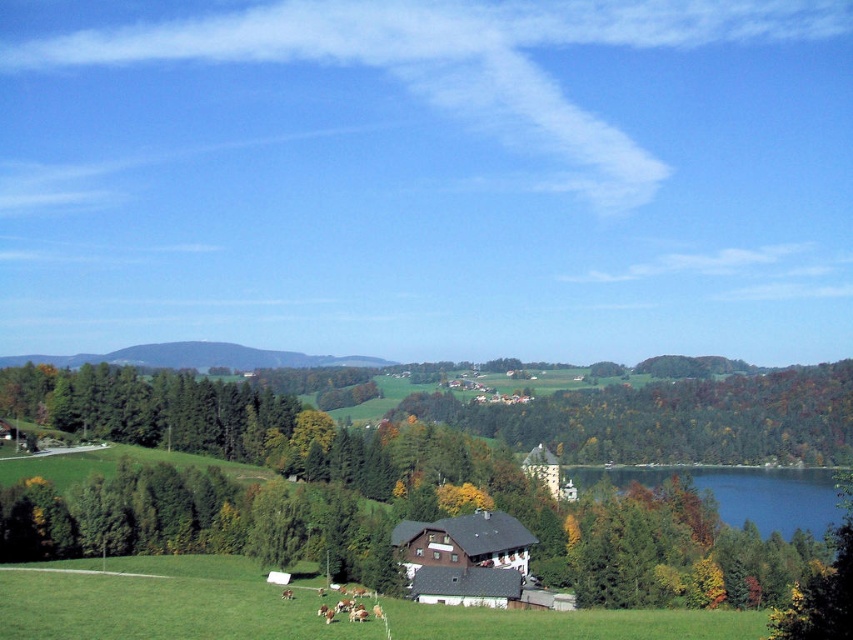
Between green matte tree at center and green grassy hillside at center, which one has less height?

green grassy hillside at center is shorter.

Which is behind, point (473, 516) or point (71, 356)?

Positioned behind is point (71, 356).

Does point (115, 401) lie in front of point (374, 364)?

That is True.

Identify the location of green matte tree at center. This screenshot has width=853, height=640. (364, 497).